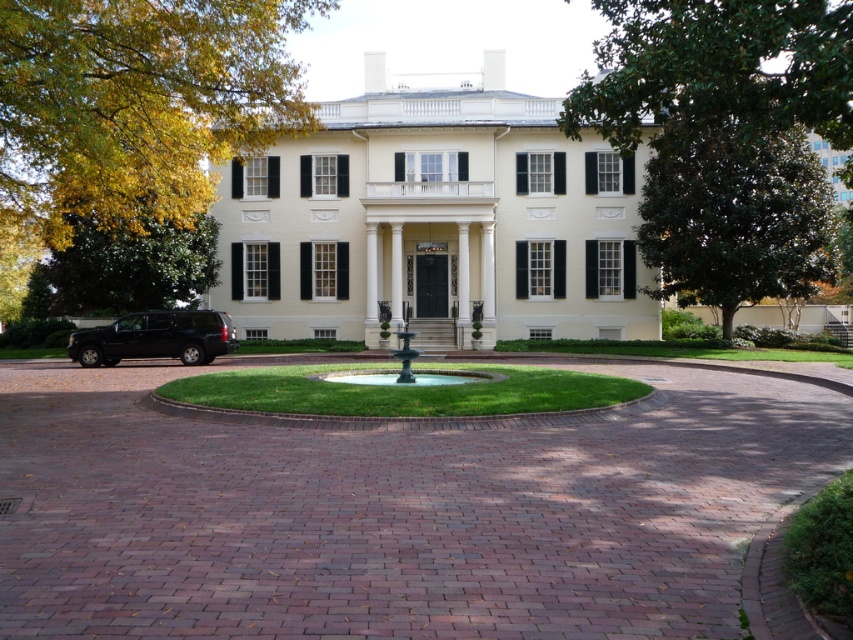
Question: Considering the real-world distances, which object is closest to the green leafy tree at left?

Choices:
 (A) green leafy tree at upper right
 (B) shiny black suv at lower left
 (C) brick at center

Answer: (B)

Question: Which point is closer to the camera?

Choices:
 (A) (155, 264)
 (B) (583, 196)
 (C) (646, 61)

Answer: (C)

Question: Is brick at center above green leafy tree at left?

Choices:
 (A) yes
 (B) no

Answer: (B)

Question: Which point is farther to the camera?

Choices:
 (A) yellow leafy tree at upper left
 (B) brick at center
 (C) white matte building at center
 (D) green leafy tree at upper right

Answer: (C)

Question: Is white matte building at center above shiny black suv at lower left?

Choices:
 (A) yes
 (B) no

Answer: (A)

Question: Can you confirm if white matte building at center is positioned to the right of green leafy tree at left?

Choices:
 (A) yes
 (B) no

Answer: (A)